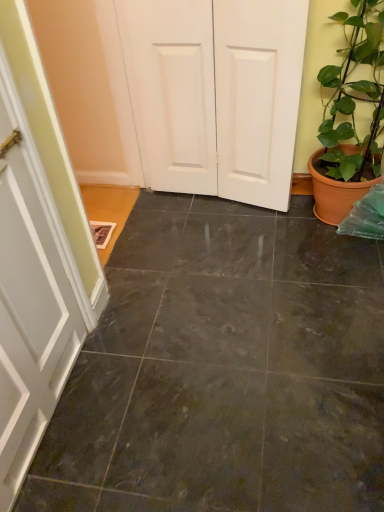
Question: Relative to green glossy plant at right, is dark gray tile floor at center in front or behind?

Choices:
 (A) behind
 (B) front

Answer: (B)

Question: From the image's perspective, is dark gray tile floor at center located above or below green glossy plant at right?

Choices:
 (A) above
 (B) below

Answer: (B)

Question: Which object is the closest to the green glossy plant at right?

Choices:
 (A) dark gray tile floor at center
 (B) white matte door at center

Answer: (B)

Question: Which object is positioned farthest from the white matte door at center?

Choices:
 (A) dark gray tile floor at center
 (B) green glossy plant at right

Answer: (A)